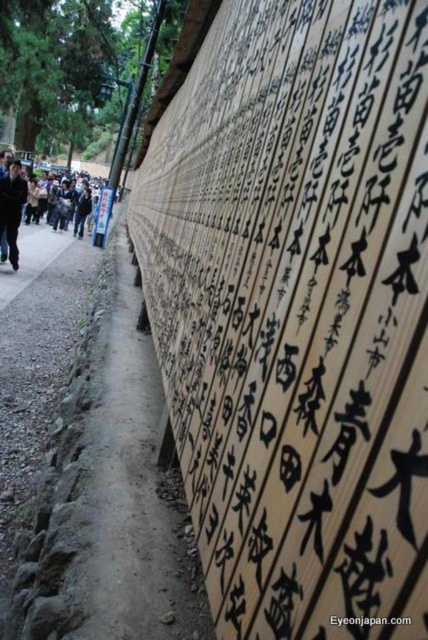
Does dark brown leather jacket at left have a lesser width compared to dark blue jacket at left?

In fact, dark brown leather jacket at left might be wider than dark blue jacket at left.

Between dark brown leather jacket at left and dark blue jacket at left, which one appears on the left side from the viewer's perspective?

From the viewer's perspective, dark brown leather jacket at left appears more on the left side.

Describe the element at coordinates (11, 208) in the screenshot. I see `dark brown leather jacket at left` at that location.

This screenshot has height=640, width=428. Identify the location of dark brown leather jacket at left. (11, 208).

Does dirt path at center appear on the right side of dark blue jacket at left?

Indeed, dirt path at center is positioned on the right side of dark blue jacket at left.

In order to click on dirt path at center in this screenshot , I will do `click(130, 490)`.

Where is `dirt path at center`? The image size is (428, 640). dirt path at center is located at coordinates (130, 490).

Find the location of a particular element. This screenshot has height=640, width=428. dirt path at center is located at coordinates (130, 490).

Can you confirm if dirt path at center is taller than dark brown leather jacket at left?

No.

Who is more forward, (101,515) or (3,186)?

Point (101,515)

Image resolution: width=428 pixels, height=640 pixels. Find the location of `dirt path at center`. dirt path at center is located at coordinates (130, 490).